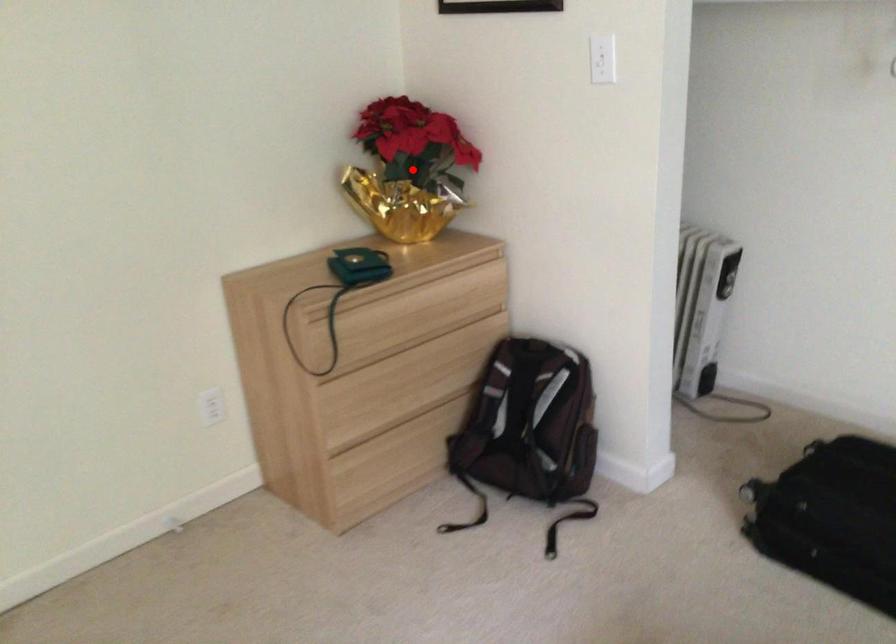
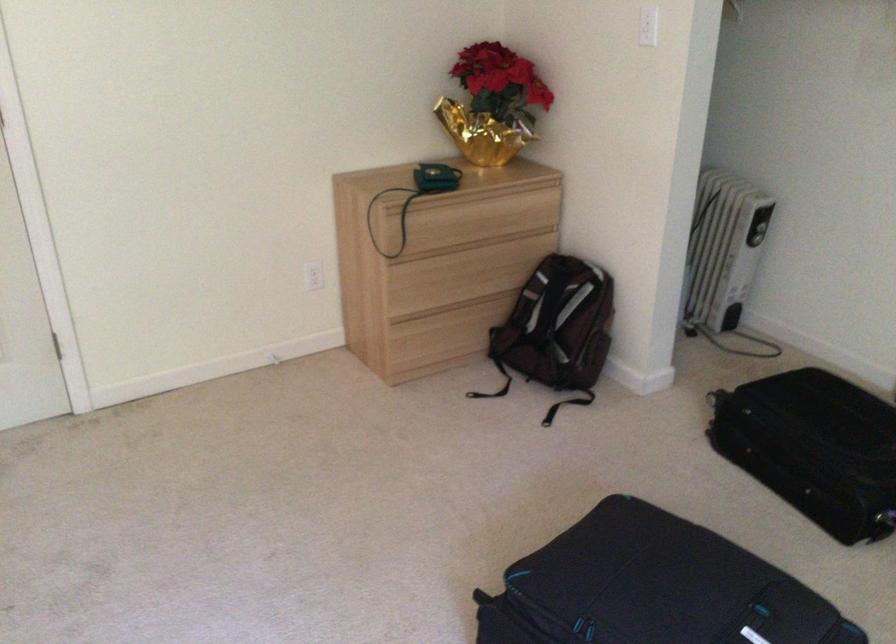
Question: I am providing you with two images of the same scene from different viewpoints. Given a red point in image1, look at the same physical point in image2. Is it:

Choices:
 (A) Closer to the viewpoint
 (B) Farther from the viewpoint

Answer: (B)